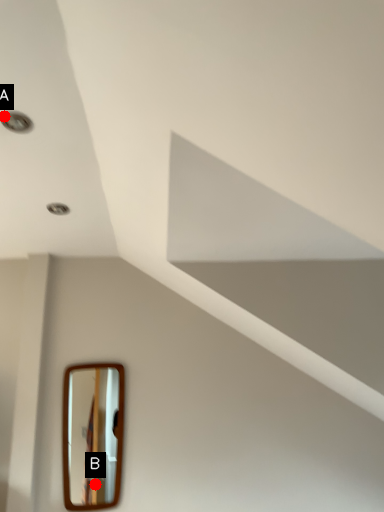
Question: Two points are circled on the image, labeled by A and B beside each circle. Which point appears farthest from the camera in this image?

Choices:
 (A) A is further
 (B) B is further

Answer: (B)